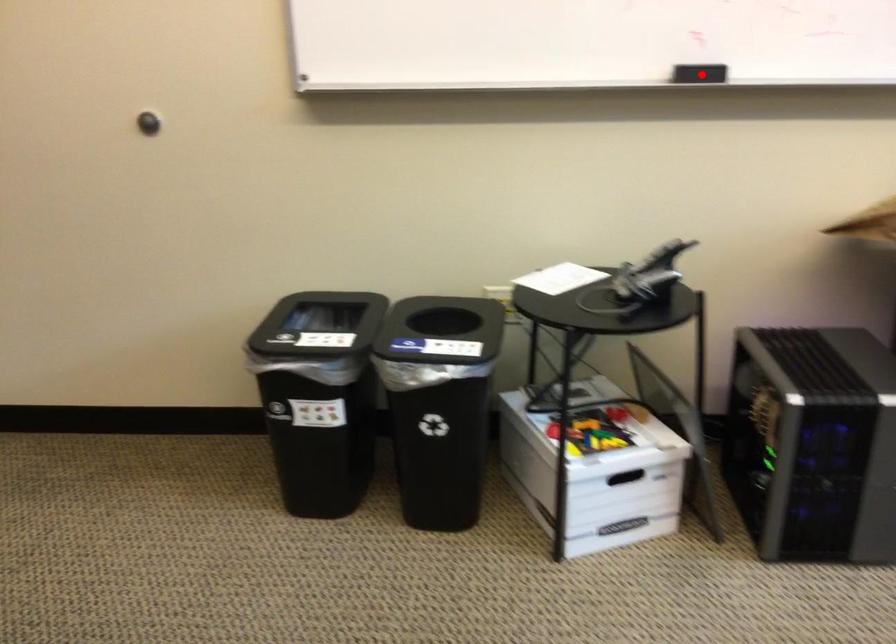
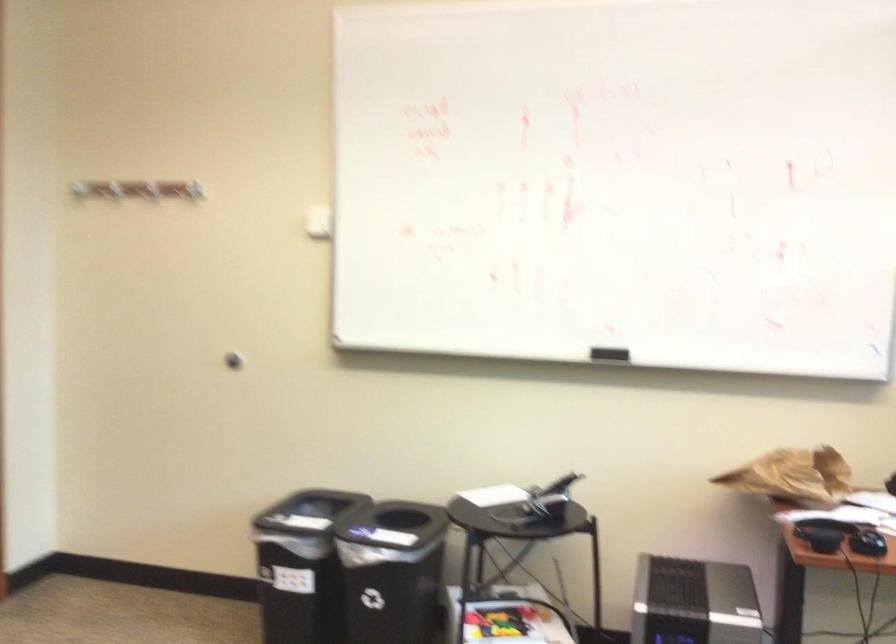
The point at the highlighted location is marked in the first image. Where is the corresponding point in the second image?

(608, 354)